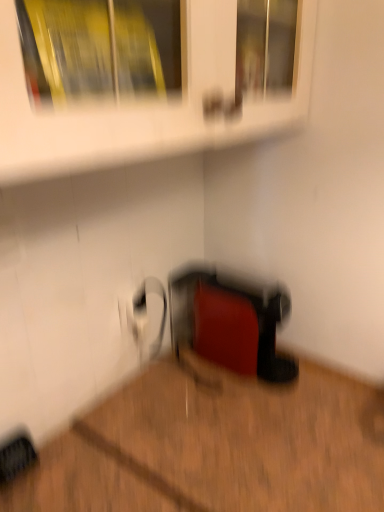
Question: Is wooden floor at lower right inside or outside of white glossy shelf at upper center?

Choices:
 (A) inside
 (B) outside

Answer: (B)

Question: Is wooden floor at lower right bigger or smaller than white glossy shelf at upper center?

Choices:
 (A) big
 (B) small

Answer: (A)

Question: Estimate the real-world distances between objects in this image. Which object is farther from the rubberized red toaster at lower center?

Choices:
 (A) white glossy shelf at upper center
 (B) wooden floor at lower right

Answer: (A)

Question: Which is nearer to the white glossy shelf at upper center?

Choices:
 (A) wooden floor at lower right
 (B) rubberized red toaster at lower center

Answer: (B)